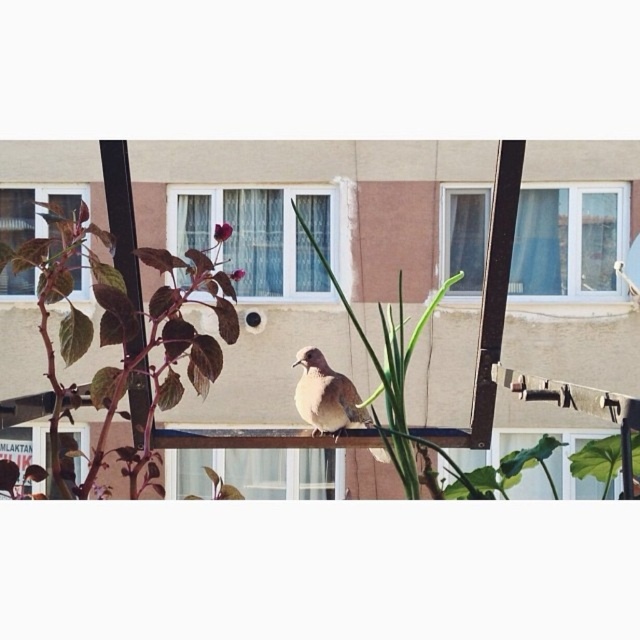
Question: Does shiny purple leaves at left have a lesser width compared to brown speckled bird at center?

Choices:
 (A) no
 (B) yes

Answer: (A)

Question: Among these points, which one is farthest from the camera?

Choices:
 (A) click(385, 436)
 (B) click(42, 273)

Answer: (A)

Question: Can you confirm if shiny purple leaves at left is positioned above green leafy plant at center?

Choices:
 (A) yes
 (B) no

Answer: (A)

Question: Which point appears closest to the camera in this image?

Choices:
 (A) (291, 364)
 (B) (403, 339)
 (C) (173, 364)

Answer: (C)

Question: Which of the following is the farthest from the observer?

Choices:
 (A) brown speckled bird at center
 (B) green leafy plant at center

Answer: (B)

Question: Is shiny purple leaves at left bigger than brown speckled bird at center?

Choices:
 (A) yes
 (B) no

Answer: (A)